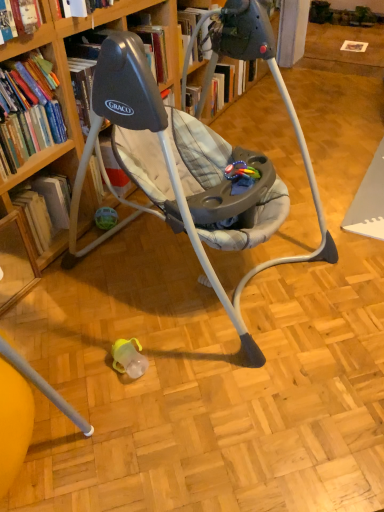
Question: Based on their sizes in the image, would you say hardcover book at left, positioned as the 2th book in top-to-bottom order, is bigger or smaller than wooden bookcase at upper left?

Choices:
 (A) small
 (B) big

Answer: (A)

Question: Considering the positions of hardcover book at left, positioned as the 2th book in top-to-bottom order, and wooden bookcase at upper left in the image, is hardcover book at left, positioned as the 2th book in top-to-bottom order, taller or shorter than wooden bookcase at upper left?

Choices:
 (A) short
 (B) tall

Answer: (A)

Question: Considering the real-world distances, which object is farthest from the hardcover book at left, which is the first book in bottom-to-top order?

Choices:
 (A) hardcover book at left, which is counted as the 2th book, starting from the bottom
 (B) wooden bookcase at upper left

Answer: (B)

Question: Which is nearer to the hardcover book at left, placed as the first book when sorted from top to bottom?

Choices:
 (A) wooden bookcase at upper left
 (B) hardcover book at left, positioned as the 2th book in top-to-bottom order

Answer: (B)